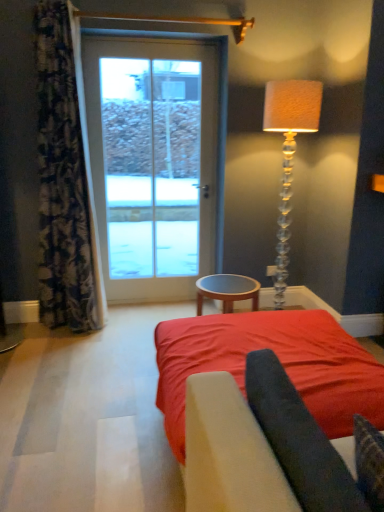
Question: Is floral fabric curtain at left aimed at translucent glass floor lamp at right?

Choices:
 (A) yes
 (B) no

Answer: (B)

Question: Can you confirm if floral fabric curtain at left is thinner than translucent glass floor lamp at right?

Choices:
 (A) no
 (B) yes

Answer: (B)

Question: Can you confirm if floral fabric curtain at left is bigger than translucent glass floor lamp at right?

Choices:
 (A) no
 (B) yes

Answer: (B)

Question: Is floral fabric curtain at left in front of translucent glass floor lamp at right?

Choices:
 (A) yes
 (B) no

Answer: (A)

Question: From a real-world perspective, is floral fabric curtain at left under translucent glass floor lamp at right?

Choices:
 (A) yes
 (B) no

Answer: (B)

Question: From a real-world perspective, relative to dark fabric at center, is red fabric bed at center vertically above or below?

Choices:
 (A) above
 (B) below

Answer: (B)

Question: Is red fabric bed at center inside or outside of dark fabric at center?

Choices:
 (A) inside
 (B) outside

Answer: (B)

Question: Is red fabric bed at center wider or thinner than dark fabric at center?

Choices:
 (A) thin
 (B) wide

Answer: (B)

Question: From the image's perspective, is red fabric bed at center positioned above or below dark fabric at center?

Choices:
 (A) below
 (B) above

Answer: (A)

Question: Considering the positions of white glass door at center and floral fabric curtain at left in the image, is white glass door at center wider or thinner than floral fabric curtain at left?

Choices:
 (A) thin
 (B) wide

Answer: (A)

Question: In the image, is white glass door at center positioned in front of or behind floral fabric curtain at left?

Choices:
 (A) behind
 (B) front

Answer: (A)

Question: Which is correct: white glass door at center is inside floral fabric curtain at left, or outside of it?

Choices:
 (A) inside
 (B) outside

Answer: (B)

Question: Is point (201, 106) closer or farther from the camera than point (64, 225)?

Choices:
 (A) closer
 (B) farther

Answer: (B)

Question: Is red fabric bed at center taller or shorter than brown wooden table at center?

Choices:
 (A) tall
 (B) short

Answer: (B)

Question: Does point (306, 372) appear closer or farther from the camera than point (249, 289)?

Choices:
 (A) farther
 (B) closer

Answer: (B)